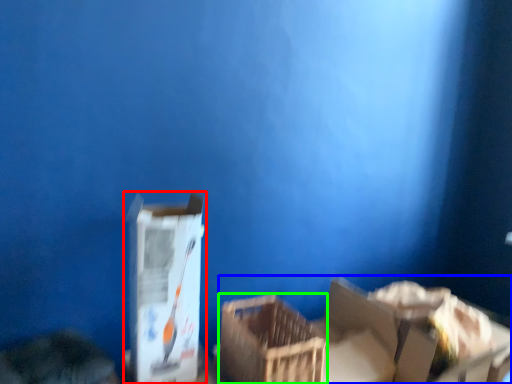
Question: Which object is positioned closest to box (highlighted by a red box)? Select from storage box (highlighted by a blue box) and crate (highlighted by a green box).

Choices:
 (A) storage box
 (B) crate

Answer: (B)